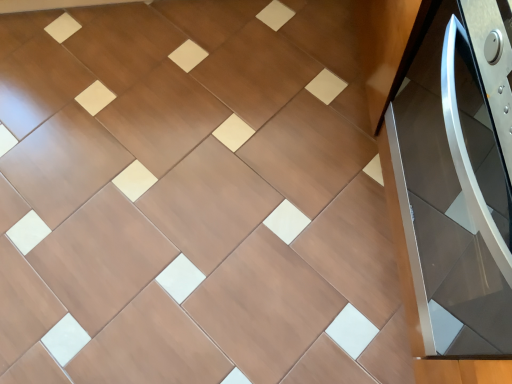
Measure the distance between point (399,187) and camera.

A distance of 1.01 meters exists between point (399,187) and camera.

In order to face silver metallic oven door at right, should I rotate leftwards or rightwards?

Rotate your view right by about 32.829°.

Image resolution: width=512 pixels, height=384 pixels. What are the coordinates of `silver metallic oven door at right` in the screenshot? It's located at (451, 199).

The image size is (512, 384). Describe the element at coordinates (451, 199) in the screenshot. I see `silver metallic oven door at right` at that location.

What are the coordinates of `silver metallic oven door at right` in the screenshot? It's located at (451, 199).